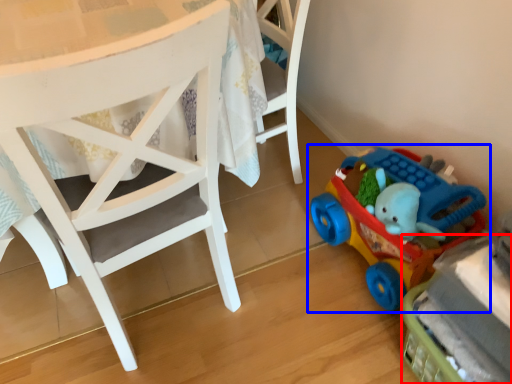
Question: Which object is closer to the camera taking this photo, toy (highlighted by a red box) or toy (highlighted by a blue box)?

Choices:
 (A) toy
 (B) toy

Answer: (A)